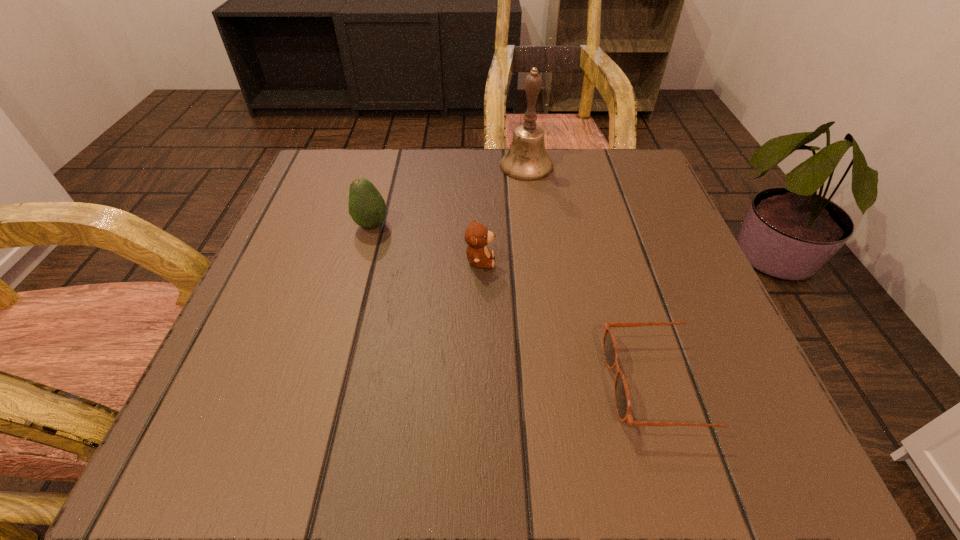
At what (x,y) coordinates should I click in order to perform the action: click on blank space located on the face of the second nearest object. Please return your answer as a coordinate pair (x, y). The height and width of the screenshot is (540, 960). Looking at the image, I should click on pos(677,261).

The width and height of the screenshot is (960, 540). Find the location of `vacant space situated 0.260m on the front-facing side of the nearest object`. vacant space situated 0.260m on the front-facing side of the nearest object is located at coordinates (426, 384).

Where is `vacant space located 0.100m on the front-facing side of the nearest object`? The height and width of the screenshot is (540, 960). vacant space located 0.100m on the front-facing side of the nearest object is located at coordinates (539, 384).

Find the location of a particular element. The width and height of the screenshot is (960, 540). free location located on the front-facing side of the nearest object is located at coordinates (447, 384).

Where is `object that is at the far edge`? Image resolution: width=960 pixels, height=540 pixels. object that is at the far edge is located at coordinates (527, 160).

Where is `object that is at the near edge`? object that is at the near edge is located at coordinates (623, 406).

Image resolution: width=960 pixels, height=540 pixels. I want to click on object present at the left edge, so click(x=367, y=207).

Locate an element on the screen. Image resolution: width=960 pixels, height=540 pixels. object that is positioned at the right edge is located at coordinates (623, 406).

Where is `object present at the near right corner`? object present at the near right corner is located at coordinates (623, 406).

Where is `free location at the far edge of the desktop`? free location at the far edge of the desktop is located at coordinates (425, 171).